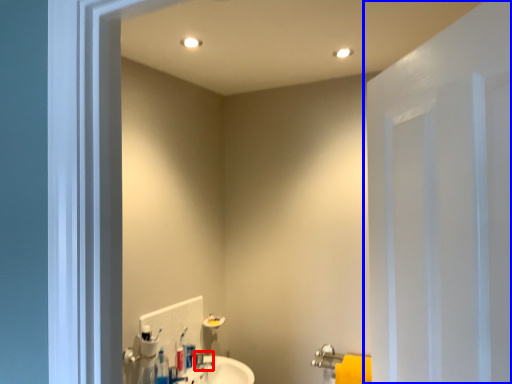
Question: Which of the following is the closest to the observer, plumbing fixture (highlighted by a red box) or door (highlighted by a blue box)?

Choices:
 (A) plumbing fixture
 (B) door

Answer: (B)